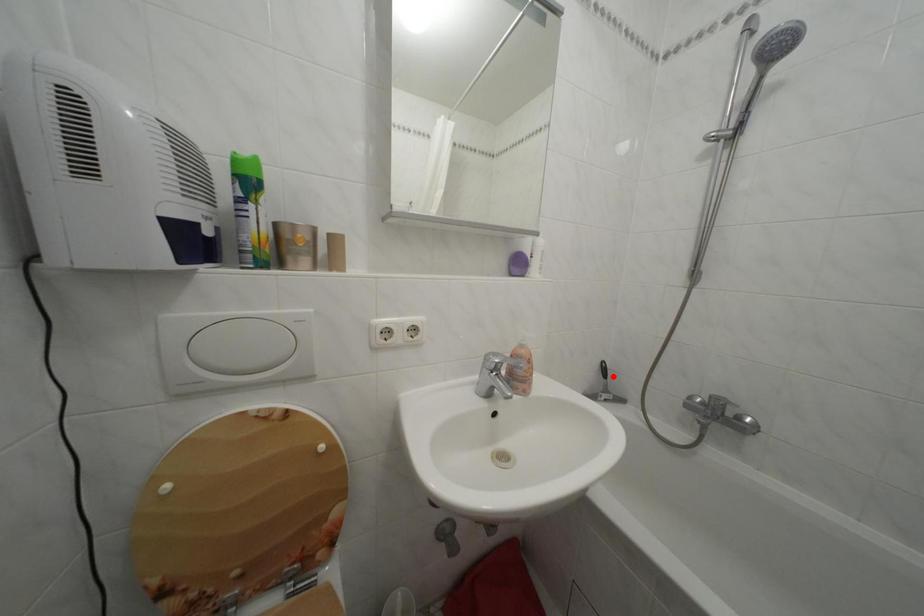
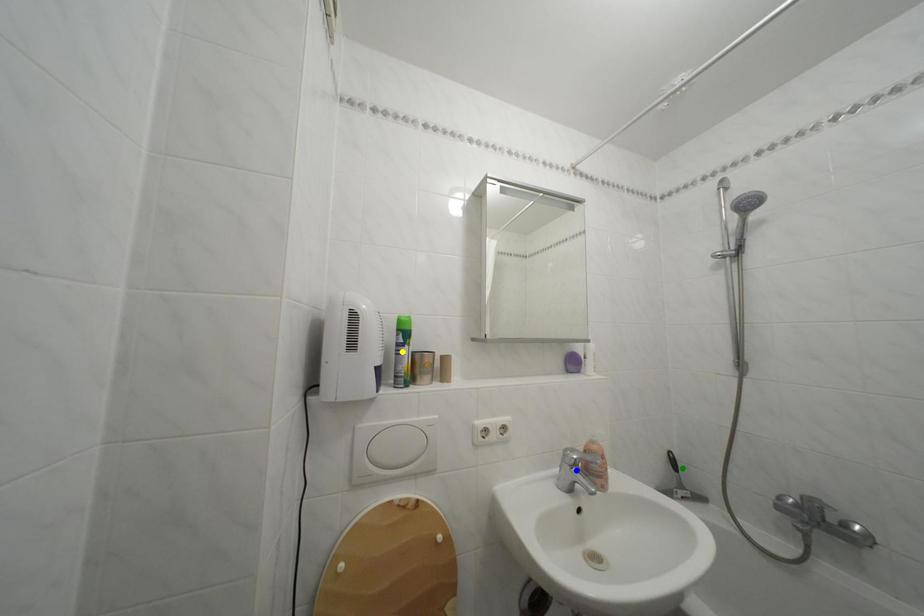
Question: I am providing you with two images of the same scene from different viewpoints. A red point is marked on the first image. You are given multiple points on the second image. In image 2, which mark is for the same physical point as the one in image 1?

Choices:
 (A) yellow point
 (B) green point
 (C) blue point

Answer: (B)